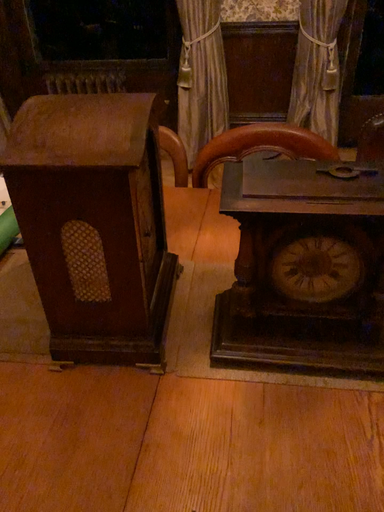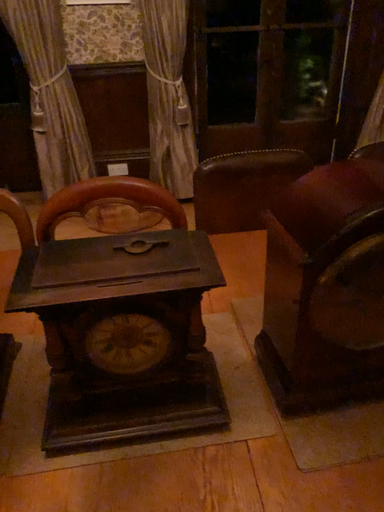
Question: Which way did the camera rotate in the video?

Choices:
 (A) rotated right
 (B) rotated left

Answer: (A)